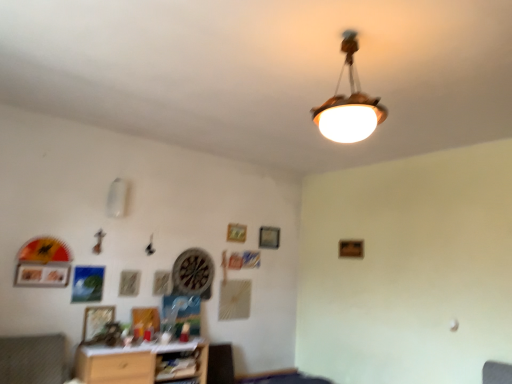
Question: From the image's perspective, would you say wooden picture frame at upper center, placed as the 3th picture frame when sorted from left to right, is positioned over textured fabric swivel chair at lower left?

Choices:
 (A) no
 (B) yes

Answer: (B)

Question: Does wooden picture frame at upper center, which is the 3th picture frame from bottom to top, have a smaller size compared to textured fabric swivel chair at lower left?

Choices:
 (A) yes
 (B) no

Answer: (A)

Question: Does wooden picture frame at upper center, marked as the 3th picture frame in a front-to-back arrangement, have a greater height compared to textured fabric swivel chair at lower left?

Choices:
 (A) no
 (B) yes

Answer: (A)

Question: Is wooden picture frame at upper center, marked as the 1th picture frame in a right-to-left arrangement, next to textured fabric swivel chair at lower left and touching it?

Choices:
 (A) yes
 (B) no

Answer: (B)

Question: Is wooden picture frame at upper center, arranged as the first picture frame when viewed from the back, wider than textured fabric swivel chair at lower left?

Choices:
 (A) no
 (B) yes

Answer: (A)

Question: Considering the positions of wooden shelf at lower center and matte silver picture frame at lower left, positioned as the 1th picture frame in left-to-right order, in the image, is wooden shelf at lower center taller or shorter than matte silver picture frame at lower left, positioned as the 1th picture frame in left-to-right order,?

Choices:
 (A) tall
 (B) short

Answer: (A)

Question: Is wooden shelf at lower center wider or thinner than matte silver picture frame at lower left, acting as the third picture frame starting from the right?

Choices:
 (A) wide
 (B) thin

Answer: (A)

Question: Would you say wooden shelf at lower center is to the left or to the right of matte silver picture frame at lower left, positioned as the 1th picture frame in left-to-right order, in the picture?

Choices:
 (A) left
 (B) right

Answer: (B)

Question: From a real-world perspective, is wooden shelf at lower center physically located above or below matte silver picture frame at lower left, which is the 2th picture frame in top-to-bottom order?

Choices:
 (A) below
 (B) above

Answer: (A)

Question: From a real-world perspective, is matte silver picture frame at lower left, which is the 2th picture frame in top-to-bottom order, physically located above or below textured fabric swivel chair at lower left?

Choices:
 (A) above
 (B) below

Answer: (A)

Question: In the image, is matte silver picture frame at lower left, which ranks as the 3th picture frame in back-to-front order, on the left side or the right side of textured fabric swivel chair at lower left?

Choices:
 (A) left
 (B) right

Answer: (A)

Question: Is point click(x=39, y=266) closer or farther from the camera than point click(x=53, y=369)?

Choices:
 (A) closer
 (B) farther

Answer: (B)

Question: Based on their sizes in the image, would you say matte silver picture frame at lower left, arranged as the 2th picture frame when ordered from the bottom, is bigger or smaller than textured fabric swivel chair at lower left?

Choices:
 (A) big
 (B) small

Answer: (B)

Question: Considering the positions of point (200, 258) and point (33, 274), is point (200, 258) closer or farther from the camera than point (33, 274)?

Choices:
 (A) farther
 (B) closer

Answer: (A)

Question: Relative to matte silver picture frame at lower left, the first picture frame in the front-to-back sequence, is wooden dartboard at center in front or behind?

Choices:
 (A) behind
 (B) front

Answer: (A)